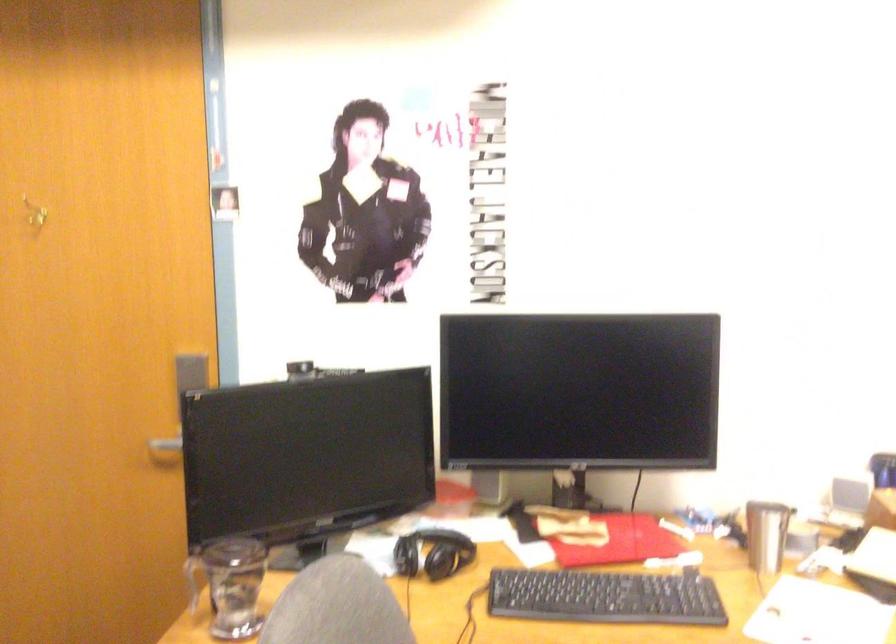
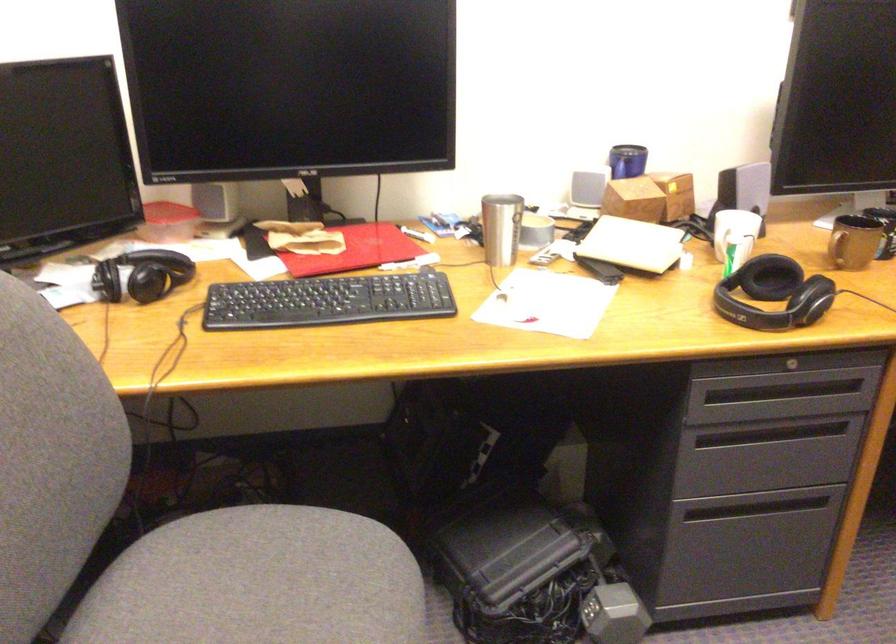
Where in the second image is the point corresponding to (x=764, y=533) from the first image?

(501, 228)